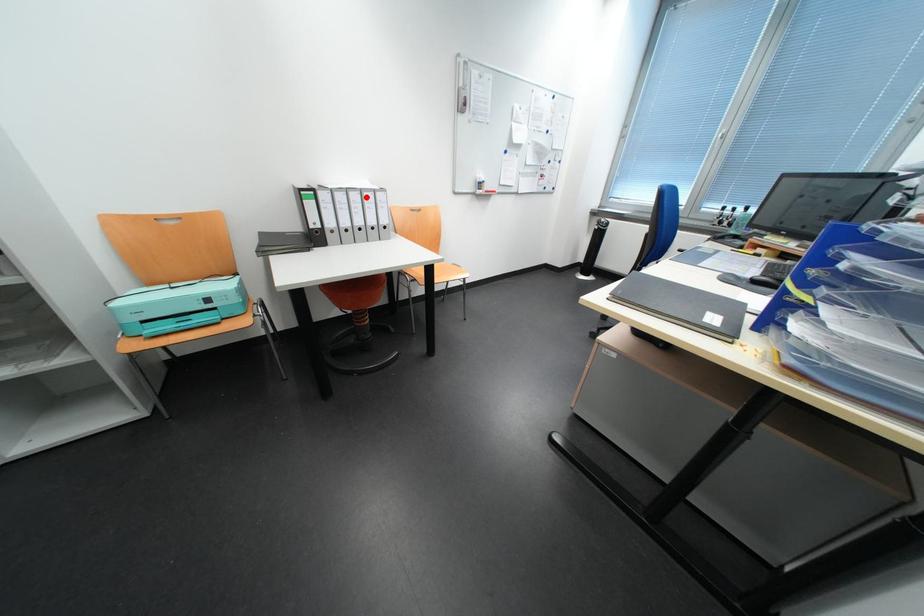
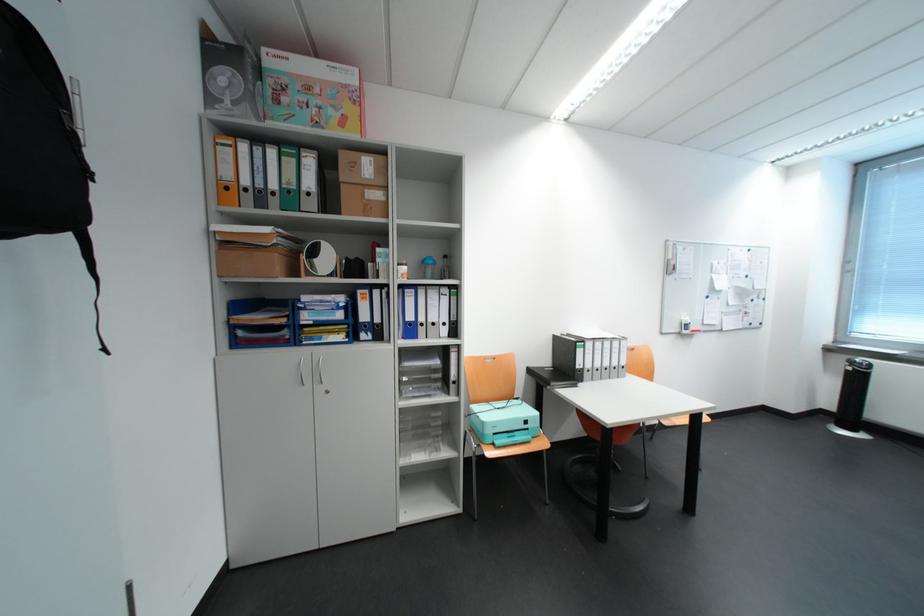
Question: I am providing you with two images of the same scene from different viewpoints. Image1 has a red point marked. In image2, the corresponding 3D location appears at what relative position? Reply with the corresponding letter.

Choices:
 (A) Closer
 (B) Farther

Answer: (B)